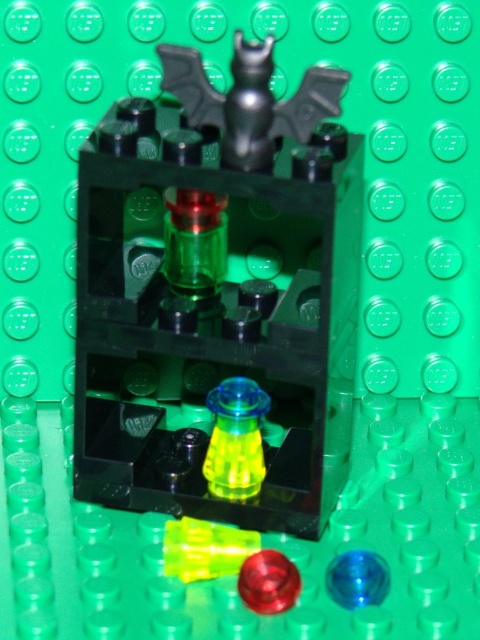
You are a child trying to reach for the transparent plastic bat at upper center and the translucent yellow plastic at center inside a LEGO container. Which object should you grab first to avoid knocking over the other?

You should grab the transparent plastic bat at upper center first because it is located above the translucent yellow plastic at center, so removing it first will prevent disturbing the lower piece.